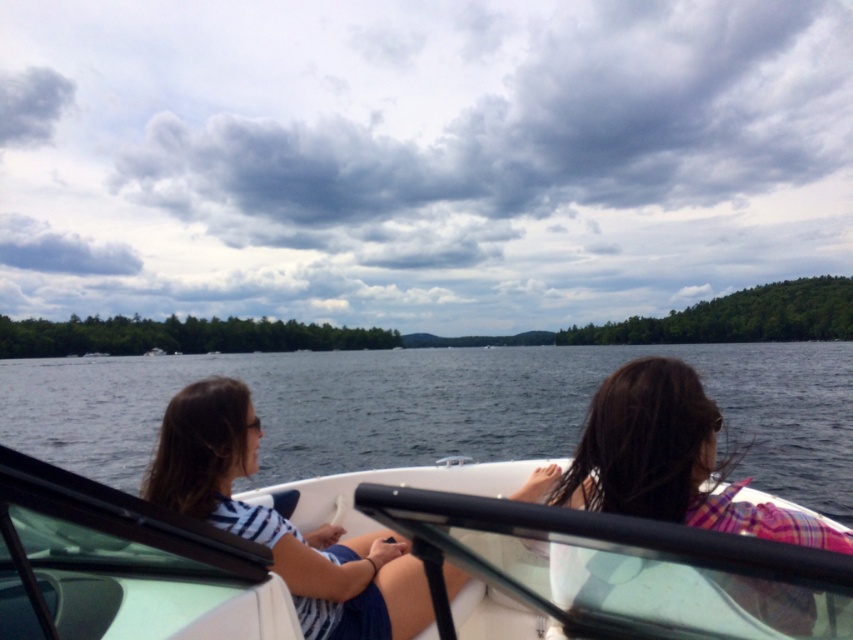
Who is taller, plaid fabric hair at center or striped fabric shirt at left?

striped fabric shirt at left

In order to click on plaid fabric hair at center in this screenshot , I will do `click(671, 460)`.

Between point (796, 536) and point (216, 493), which one is positioned in front?

Point (796, 536) is in front.

This screenshot has width=853, height=640. Find the location of `plaid fabric hair at center`. plaid fabric hair at center is located at coordinates (671, 460).

Between clear water at center and striped fabric shirt at left, which one has more height?

Standing taller between the two is clear water at center.

Can you confirm if clear water at center is thinner than striped fabric shirt at left?

In fact, clear water at center might be wider than striped fabric shirt at left.

The width and height of the screenshot is (853, 640). What are the coordinates of `clear water at center` in the screenshot? It's located at (436, 408).

From the picture: Who is taller, white glossy boat at center or striped fabric shirt at left?

white glossy boat at center

Who is more forward, [213,624] or [196,429]?

Point [213,624]

Find the location of a particular element. white glossy boat at center is located at coordinates (579, 560).